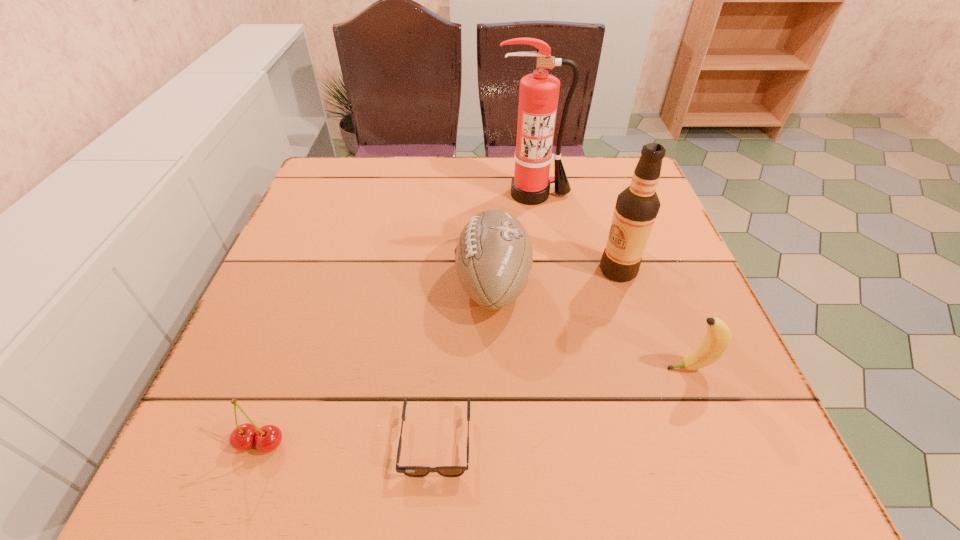
What are the coordinates of `vacant space that is in between the fifth tallest object and the alcohol` in the screenshot? It's located at (440, 356).

Where is `vacant area between the fire extinguisher and the second tallest object`? Image resolution: width=960 pixels, height=540 pixels. vacant area between the fire extinguisher and the second tallest object is located at coordinates (576, 232).

Locate an element on the screen. vacant area that lies between the sunglasses and the second tallest object is located at coordinates (527, 356).

At what (x,y) coordinates should I click in order to perform the action: click on free spot between the fourth farthest object and the second shortest object. Please return your answer as a coordinate pair (x, y). Looking at the image, I should click on (475, 406).

Where is `vacant area between the shortest object and the farthest object`? vacant area between the shortest object and the farthest object is located at coordinates (485, 318).

Identify the location of vacant region between the second tallest object and the football (American). This screenshot has width=960, height=540. (556, 277).

Where is `blank region between the second shortest object and the farthest object`? The height and width of the screenshot is (540, 960). blank region between the second shortest object and the farthest object is located at coordinates (396, 319).

Where is `vacant space that is in between the football (American) and the banana`? vacant space that is in between the football (American) and the banana is located at coordinates (591, 326).

The image size is (960, 540). In order to click on vacant point located between the football (American) and the sunglasses in this screenshot , I will do `click(465, 362)`.

The image size is (960, 540). What are the coordinates of `the fifth closest object to the second tallest object` in the screenshot? It's located at pos(267,438).